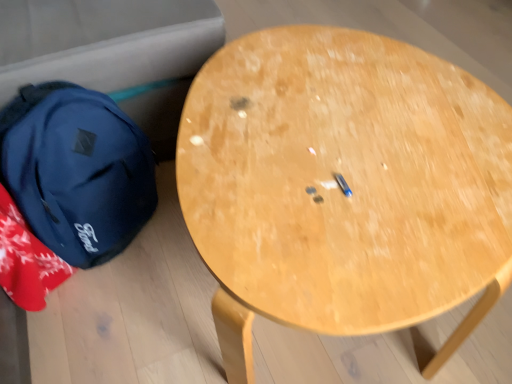
The height and width of the screenshot is (384, 512). I want to click on empty space that is ontop of light wood table at center (from a real-world perspective), so click(340, 127).